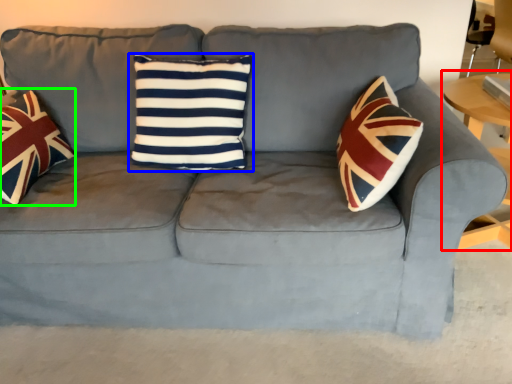
Question: Which is farther away from table (highlighted by a red box)? pillow (highlighted by a blue box) or throw pillow (highlighted by a green box)?

Choices:
 (A) pillow
 (B) throw pillow

Answer: (B)